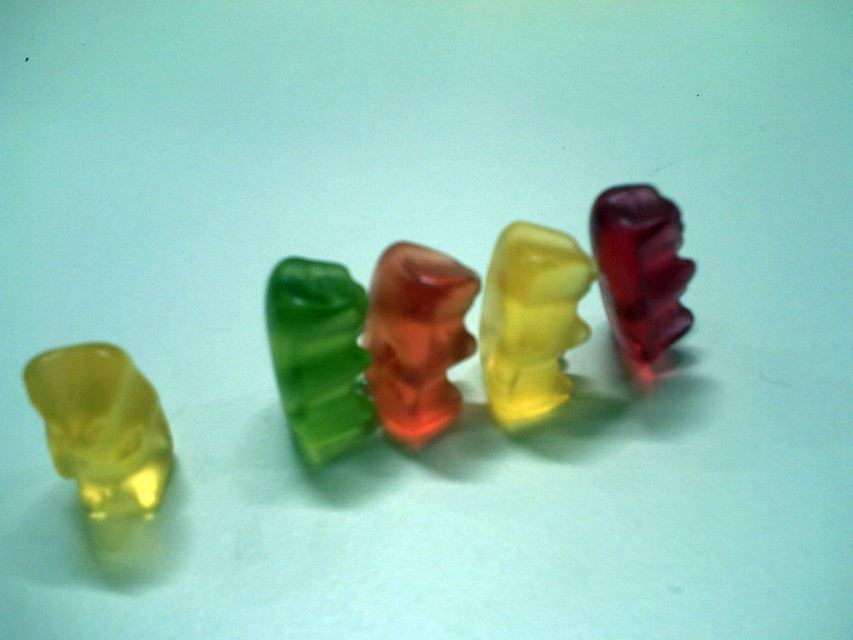
Question: Can you confirm if translucent yellow bear at center is positioned to the right of translucent red gummy bear at right?

Choices:
 (A) no
 (B) yes

Answer: (A)

Question: Can you confirm if translucent red bear at center is thinner than translucent red gummy bear at right?

Choices:
 (A) no
 (B) yes

Answer: (A)

Question: Which point is farther from the camera taking this photo?

Choices:
 (A) (302, 296)
 (B) (399, 276)

Answer: (B)

Question: Which point appears closest to the camera in this image?

Choices:
 (A) (393, 275)
 (B) (555, 237)
 (C) (602, 298)
 (D) (160, 460)

Answer: (D)

Question: Which object is farther from the camera taking this photo?

Choices:
 (A) translucent yellow bear at left
 (B) green translucent bear at center
 (C) translucent yellow bear at center
 (D) translucent red bear at center

Answer: (C)

Question: Can you confirm if translucent red bear at center is positioned to the left of translucent red gummy bear at right?

Choices:
 (A) no
 (B) yes

Answer: (B)